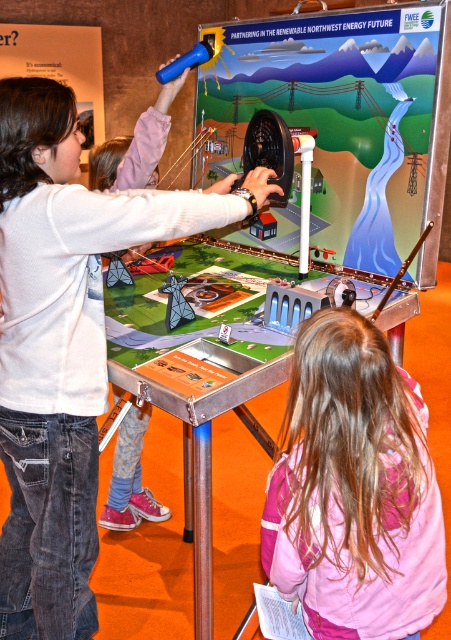
In the scene shown: You are standing at the science fair exhibit about hydroelectric power. There is a blue object at point (433, 552). If you want to reach it without moving your feet, can you do so with your arm?

The distance between you and the blue object at point (433, 552) is 3.70 feet. Since the average human arm length is about 2.5 feet, you cannot reach it without moving your feet.

You are a photographer at the science fair and need to capture a photo that includes both the pink fabric hair at upper center and the matte white shirt at upper left. Based on their positions, which object should be placed to the right in the frame?

The pink fabric hair at upper center should be placed to the right in the frame because it is positioned on the right side of the matte white shirt at upper left.

You are a photographer at the science fair and want to capture a photo that includes both the white matte shirt at upper left and the pink fabric hair at upper center. Based on their positions, which object should be placed on the left side of the photo frame?

The white matte shirt at upper left should be placed on the left side of the photo frame since it is positioned on the left side of the pink fabric hair at upper center.